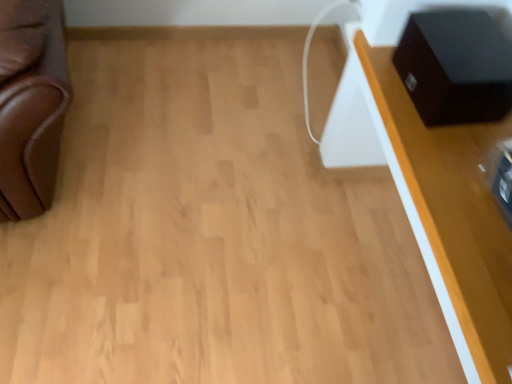
Question: Can you confirm if black matte speaker at upper right is thinner than white glossy table at upper right?

Choices:
 (A) yes
 (B) no

Answer: (A)

Question: Considering the relative sizes of black matte speaker at upper right and white glossy table at upper right in the image provided, is black matte speaker at upper right taller than white glossy table at upper right?

Choices:
 (A) yes
 (B) no

Answer: (B)

Question: Would you say black matte speaker at upper right is a long distance from white glossy table at upper right?

Choices:
 (A) yes
 (B) no

Answer: (B)

Question: Does black matte speaker at upper right have a lesser height compared to white glossy table at upper right?

Choices:
 (A) no
 (B) yes

Answer: (B)

Question: From the image's perspective, is black matte speaker at upper right on top of white glossy table at upper right?

Choices:
 (A) yes
 (B) no

Answer: (A)

Question: Is black matte speaker at upper right oriented away from white glossy table at upper right?

Choices:
 (A) yes
 (B) no

Answer: (A)

Question: Is white glossy table at upper right bigger than black matte speaker at upper right?

Choices:
 (A) no
 (B) yes

Answer: (B)

Question: Is white glossy table at upper right far from black matte speaker at upper right?

Choices:
 (A) yes
 (B) no

Answer: (B)

Question: Can you confirm if white glossy table at upper right is positioned to the left of black matte speaker at upper right?

Choices:
 (A) no
 (B) yes

Answer: (A)

Question: From the image's perspective, does white glossy table at upper right appear higher than black matte speaker at upper right?

Choices:
 (A) yes
 (B) no

Answer: (B)

Question: Is white glossy table at upper right turned away from black matte speaker at upper right?

Choices:
 (A) no
 (B) yes

Answer: (B)

Question: Does white glossy table at upper right have a lesser width compared to black matte speaker at upper right?

Choices:
 (A) yes
 (B) no

Answer: (B)

Question: Looking at their shapes, would you say white glossy table at upper right is wider or thinner than black matte speaker at upper right?

Choices:
 (A) thin
 (B) wide

Answer: (B)